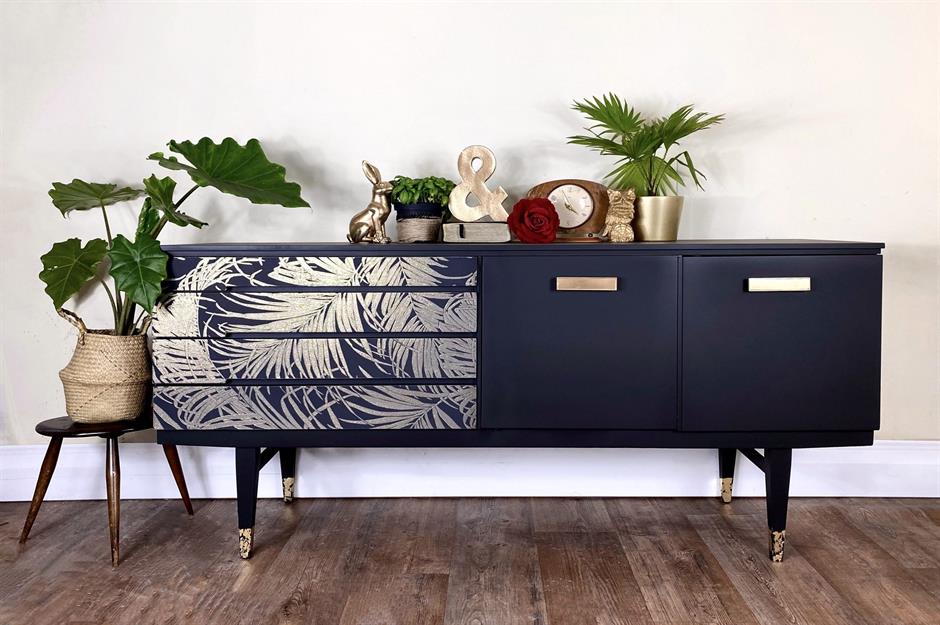
Find the location of a particular element. The height and width of the screenshot is (625, 940). clock is located at coordinates (570, 212).